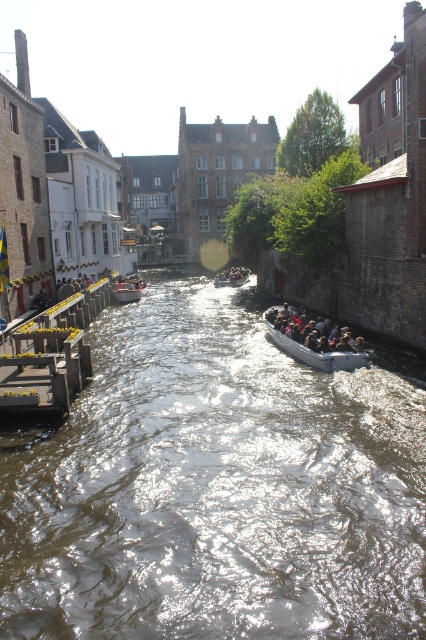
You are standing at the edge of the canal and want to reach a specific point marked at coordinates point (294, 346). If your maximum walking distance is 60 feet, can you reach it without using any water transportation?

The distance of point (294, 346) from camera is 65.87 feet, so you cannot reach it within 60 feet. You need to use water transportation.

You are standing on the canal bridge and see both the gray rubber boat at center and the metallic gray boat at center. Which boat would appear larger to you?

The gray rubber boat at center appears larger because it is closer to the viewer than the metallic gray boat at center.

You are a visitor standing on the wooden dock at left and want to board the gray rubber boat at center. Is the height difference between the dock and the boat something you need to be cautious about?

The wooden dock at left is taller than the gray rubber boat at center, so you need to be cautious about the height difference when boarding.